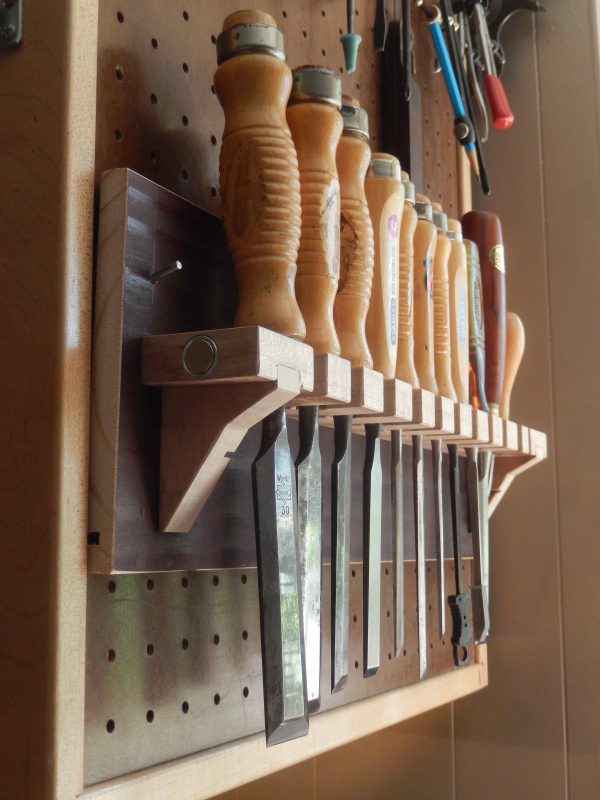
Locate an element on the screen. Image resolution: width=600 pixels, height=800 pixels. hinge is located at coordinates (11, 25).